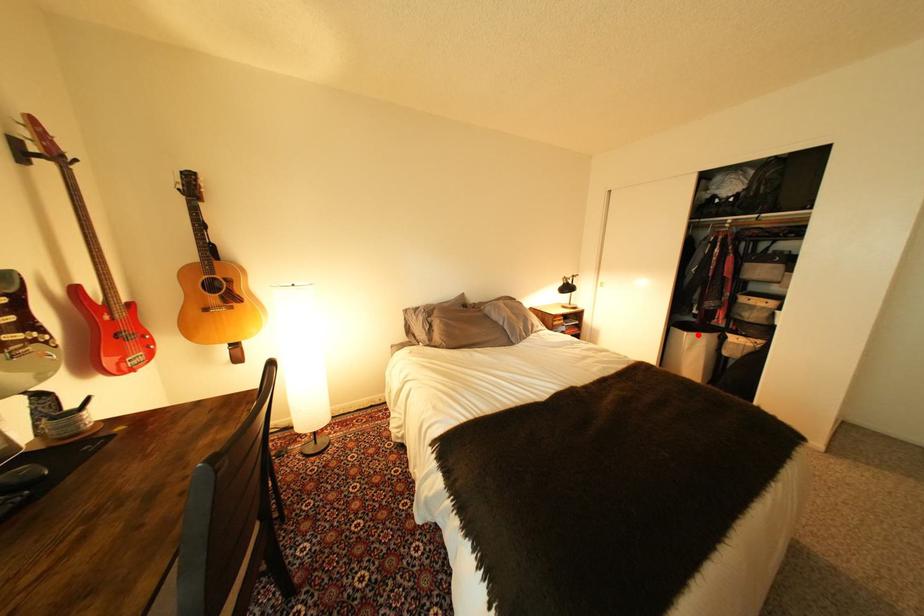
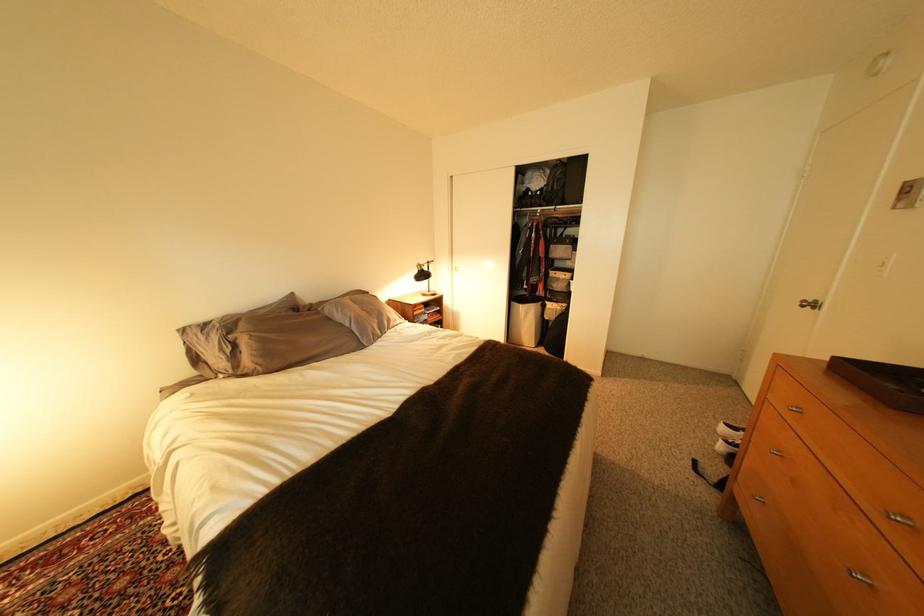
Where in the second image is the point corresponding to the highlighted location from the first image?

(533, 307)